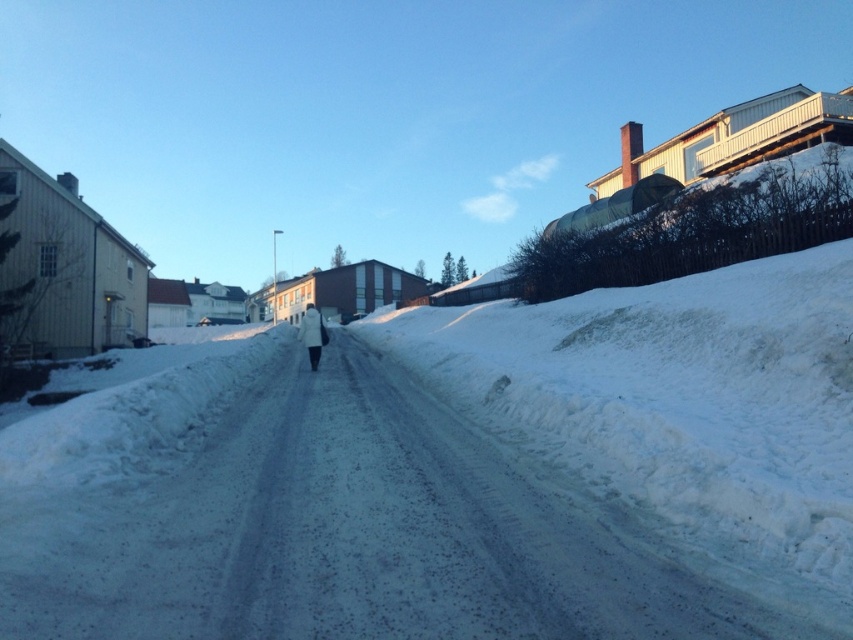
You are standing at the point marked as point (x=457, y=474) in the snowy scene. What is the immediate surface you are standing on?

The point (x=457, y=474) is on white fluffy snow at center, so you are standing on white fluffy snow at center.

You are a photographer trying to capture the white fluffy snow at center and the white fluffy coat at center in the same frame. Since both are at the center, which one appears larger in the image?

The white fluffy coat at center appears larger because it occupies more space than the white fluffy snow at center.